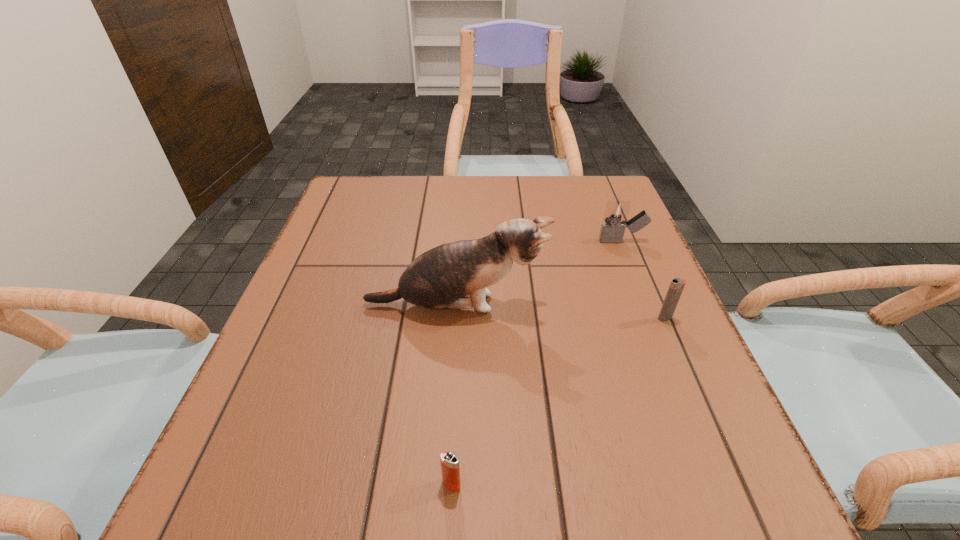
This screenshot has width=960, height=540. In order to click on unoccupied position between the second farthest igniter and the tallest object in this screenshot , I will do 560,312.

Identify the location of blank region between the second nearest igniter and the tallest object. coord(560,312).

At what (x,y) coordinates should I click in order to perform the action: click on empty space that is in between the farthest igniter and the second farthest igniter. Please return your answer as a coordinate pair (x, y). The image size is (960, 540). Looking at the image, I should click on (643, 280).

I want to click on vacant point located between the farthest object and the second farthest igniter, so click(x=643, y=280).

Locate an element on the screen. The width and height of the screenshot is (960, 540). vacant space that's between the farthest object and the second nearest igniter is located at coordinates (643, 280).

The height and width of the screenshot is (540, 960). What are the coordinates of `empty location between the farthest object and the tallest object` in the screenshot? It's located at (539, 273).

In order to click on free point between the leftmost igniter and the tallest object in this screenshot , I will do `click(453, 395)`.

The height and width of the screenshot is (540, 960). What are the coordinates of `the closest object to the farthest igniter` in the screenshot? It's located at (444, 277).

Identify which object is located as the second nearest to the nearest object. Please provide its 2D coordinates. Your answer should be formatted as a tuple, i.e. [(x, y)], where the tuple contains the x and y coordinates of a point satisfying the conditions above.

[(676, 287)]

Identify which igniter is located as the nearest to the leftmost igniter. Please provide its 2D coordinates. Your answer should be formatted as a tuple, i.e. [(x, y)], where the tuple contains the x and y coordinates of a point satisfying the conditions above.

[(676, 287)]